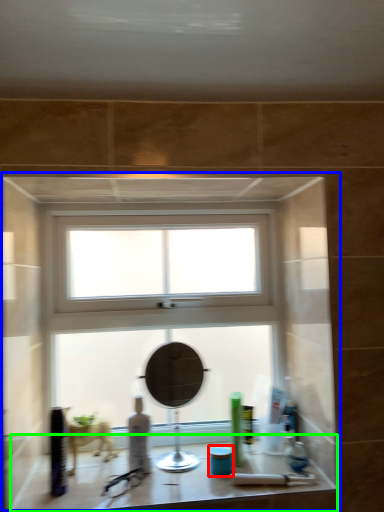
Question: Which is farther away from toiletry (highlighted by a red box)? window (highlighted by a blue box) or counter top (highlighted by a green box)?

Choices:
 (A) window
 (B) counter top

Answer: (A)